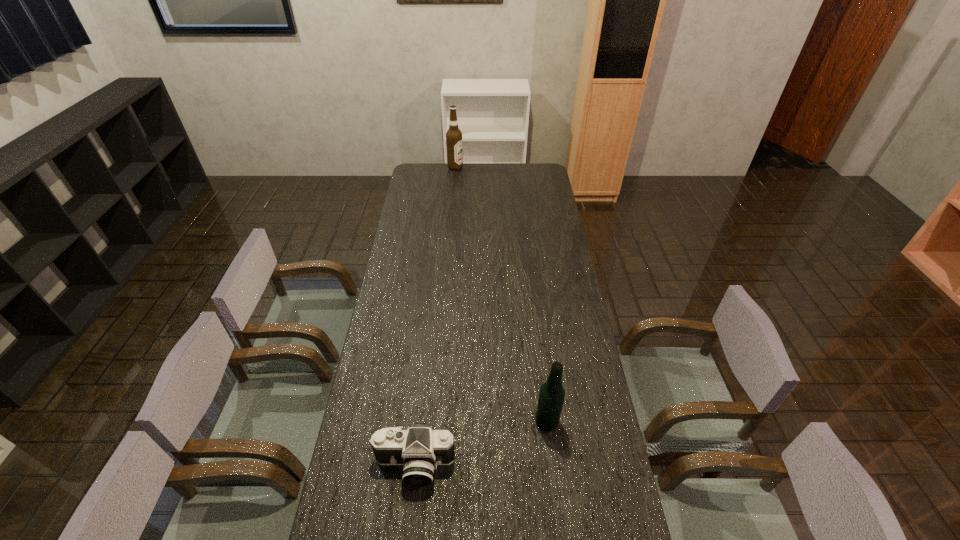
Where is `empty location between the farther alcohol and the camera`? empty location between the farther alcohol and the camera is located at coordinates (435, 316).

Locate an element on the screen. The width and height of the screenshot is (960, 540). free space between the camera and the taller alcohol is located at coordinates (435, 316).

Identify the location of object that stands as the second closest to the farther alcohol. The height and width of the screenshot is (540, 960). (420, 449).

Identify which object is the second closest to the nearer alcohol. Please provide its 2D coordinates. Your answer should be formatted as a tuple, i.e. [(x, y)], where the tuple contains the x and y coordinates of a point satisfying the conditions above.

[(453, 136)]

Find the location of `vacant space that satisfies the following two spatial constraints: 1. on the label of the farthest object; 2. on the left side of the right alcohol`. vacant space that satisfies the following two spatial constraints: 1. on the label of the farthest object; 2. on the left side of the right alcohol is located at coordinates (435, 422).

The width and height of the screenshot is (960, 540). I want to click on free spot that satisfies the following two spatial constraints: 1. on the label of the farther alcohol; 2. on the front side of the camera, so click(x=431, y=465).